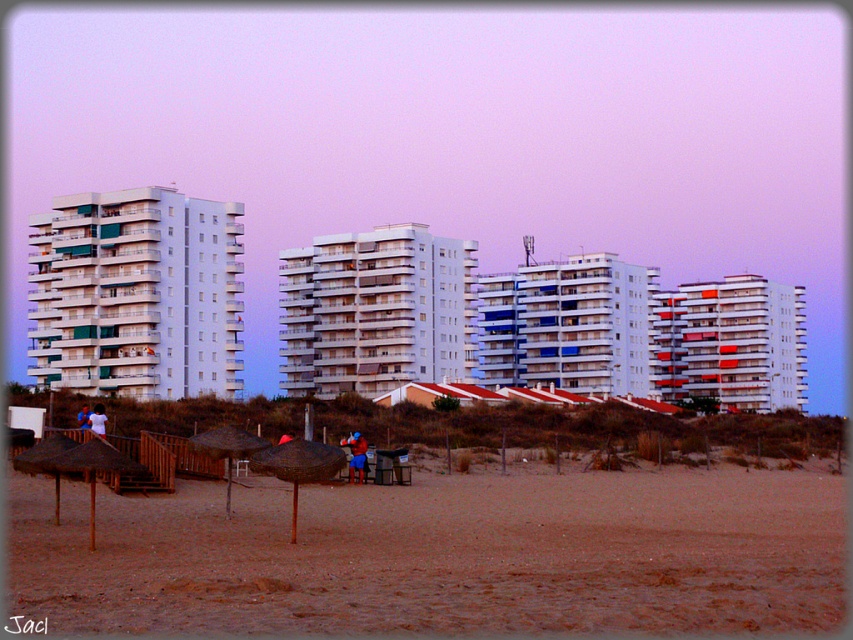
You are standing on the beach and want to place your blue fabric umbrella at lower left closer to the brown sandy beach at lower center. In which direction should you move the umbrella?

You should move the blue fabric umbrella at lower left to the right to place it closer to the brown sandy beach at lower center, since the brown sandy beach at lower center is already to the right of the blue fabric umbrella at lower left.

You are a photographer trying to capture a photo of the brown sandy beach at lower center and the blue fabric person at center. Which object should you focus on first if you want to include both in your frame without moving the camera?

The brown sandy beach at lower center is taller than the blue fabric person at center, so you should focus on the brown sandy beach at lower center first to ensure both fit in the frame.